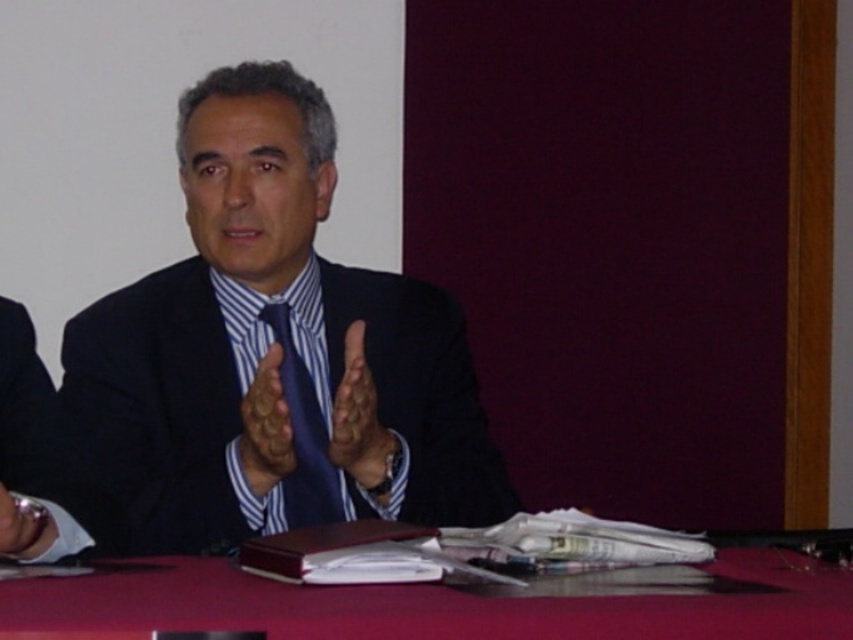
Question: Which of the following is the farthest from the observer?

Choices:
 (A) dark blue suit at center
 (B) smooth skin hand at center

Answer: (B)

Question: Which point appears closest to the camera in this image?

Choices:
 (A) (20, 538)
 (B) (257, 369)
 (C) (370, 440)
 (D) (285, 316)

Answer: (A)

Question: Is blue silk tie at center to the right of smooth skin hand at center from the viewer's perspective?

Choices:
 (A) no
 (B) yes

Answer: (A)

Question: Which of the following is the closest to the observer?

Choices:
 (A) (288, 522)
 (B) (283, 397)
 (C) (19, 548)
 (D) (358, 468)

Answer: (C)

Question: Is blue silk tie at center to the left of matte blue tie at center from the viewer's perspective?

Choices:
 (A) yes
 (B) no

Answer: (B)

Question: Is matte blue tie at center bigger than matte black hand at center?

Choices:
 (A) no
 (B) yes

Answer: (B)